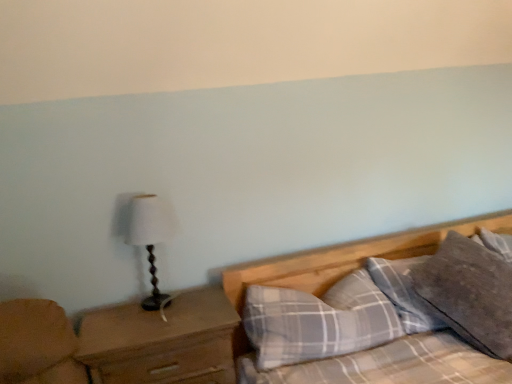
Question: Considering the relative sizes of wooden table lamp at left and brown wooden nightstand at left in the image provided, is wooden table lamp at left shorter than brown wooden nightstand at left?

Choices:
 (A) no
 (B) yes

Answer: (B)

Question: Is the depth of wooden table lamp at left greater than that of brown wooden nightstand at left?

Choices:
 (A) yes
 (B) no

Answer: (A)

Question: Could brown wooden nightstand at left be considered to be inside wooden table lamp at left?

Choices:
 (A) yes
 (B) no

Answer: (B)

Question: Is wooden table lamp at left aimed at brown wooden nightstand at left?

Choices:
 (A) yes
 (B) no

Answer: (B)

Question: Is wooden table lamp at left oriented away from brown wooden nightstand at left?

Choices:
 (A) no
 (B) yes

Answer: (A)

Question: Are wooden table lamp at left and brown wooden nightstand at left making contact?

Choices:
 (A) no
 (B) yes

Answer: (A)

Question: Is gray cotton pillow at upper right, the 2th pillow when ordered from left to right, turned away from brown wooden nightstand at left?

Choices:
 (A) no
 (B) yes

Answer: (A)

Question: Is gray cotton pillow at upper right, the 2th pillow when ordered from left to right, positioned in front of brown wooden nightstand at left?

Choices:
 (A) yes
 (B) no

Answer: (B)

Question: Is gray cotton pillow at upper right, which is counted as the first pillow, starting from the right, smaller than brown wooden nightstand at left?

Choices:
 (A) yes
 (B) no

Answer: (A)

Question: From the image's perspective, is gray cotton pillow at upper right, which is counted as the first pillow, starting from the right, located above brown wooden nightstand at left?

Choices:
 (A) yes
 (B) no

Answer: (A)

Question: Would you say gray cotton pillow at upper right, the 2th pillow when ordered from left to right, is outside brown wooden nightstand at left?

Choices:
 (A) no
 (B) yes

Answer: (B)

Question: Is gray cotton pillow at upper right, the 2th pillow when ordered from left to right, oriented towards brown wooden nightstand at left?

Choices:
 (A) no
 (B) yes

Answer: (A)

Question: Could you tell me if brown wooden nightstand at left is turned towards wooden table lamp at left?

Choices:
 (A) yes
 (B) no

Answer: (B)